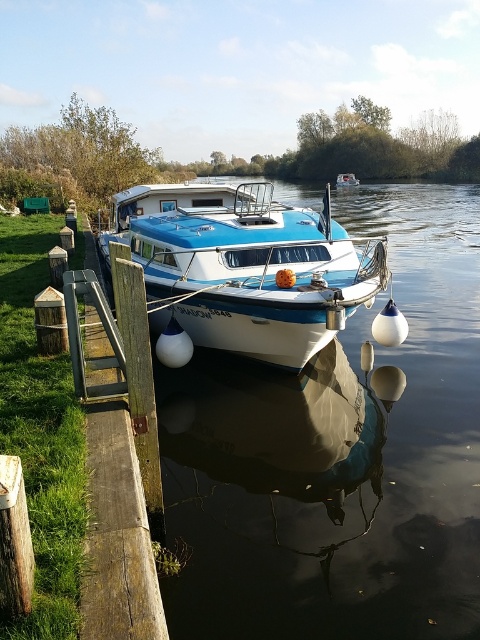
You are a tour guide explaining the coordinates of the glossy white boat at center to a visitor. What coordinates should you mention?

The glossy white boat at center is located at coordinates point (338,458).

You are standing on the wooden pier and see the blue glossy houseboat at center and the blue glossy boat at center. Which one is positioned to the left?

The blue glossy houseboat at center is positioned to the left of the blue glossy boat at center.

You are standing on the riverside and looking at the houseboat. There are two points marked on the image. Which point, point (454,545) or point (262,272), is closer to you?

Point (454,545) is closer to the camera than point (262,272), so it is closer to you.